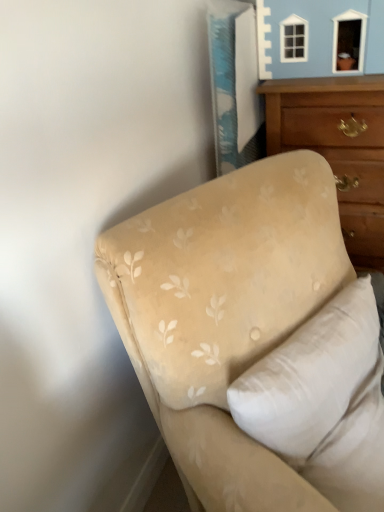
Question: Which is correct: beige fabric pillow at upper right is inside wooden chest of drawers at upper right, or outside of it?

Choices:
 (A) outside
 (B) inside

Answer: (A)

Question: From the image's perspective, relative to wooden chest of drawers at upper right, is beige fabric pillow at upper right above or below?

Choices:
 (A) below
 (B) above

Answer: (A)

Question: Which object is positioned farthest from the wooden chest of drawers at upper right?

Choices:
 (A) beige fabric couch at lower right
 (B) beige fabric pillow at upper right

Answer: (B)

Question: Estimate the real-world distances between objects in this image. Which object is closer to the beige fabric pillow at upper right?

Choices:
 (A) beige fabric couch at lower right
 (B) wooden chest of drawers at upper right

Answer: (A)